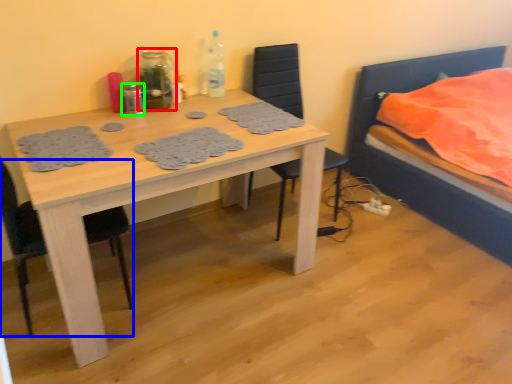
Question: Which object is positioned farthest from bottle (highlighted by a red box)? Select from chair (highlighted by a blue box) and bottle (highlighted by a green box).

Choices:
 (A) chair
 (B) bottle

Answer: (A)